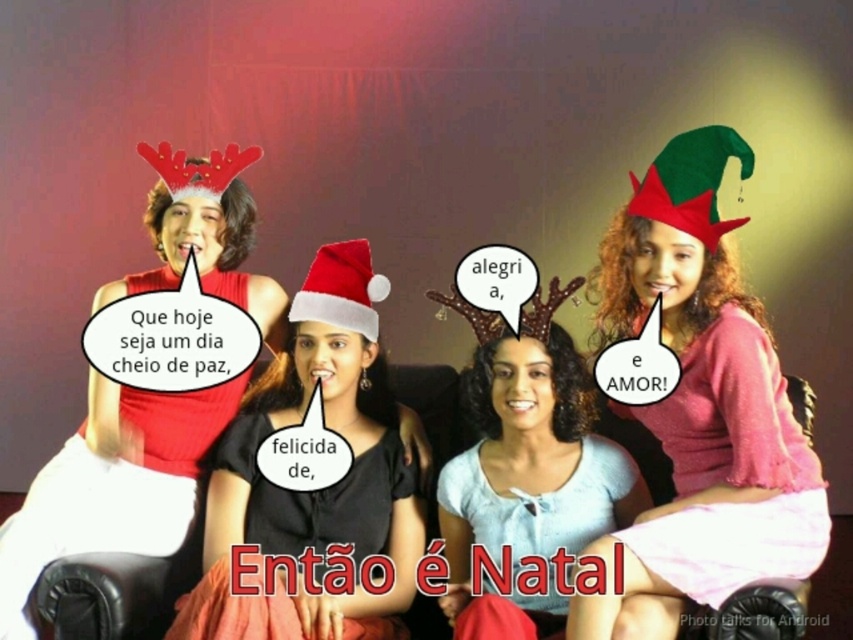
Question: Considering the real-world distances, which object is farthest from the matte red dress at left?

Choices:
 (A) green felt christmas hat at upper right
 (B) red velvet santa hat at center
 (C) matte red dress at center
 (D) pink matte sweater at upper right

Answer: (A)

Question: Does matte red dress at center have a larger size compared to green felt christmas hat at upper right?

Choices:
 (A) yes
 (B) no

Answer: (A)

Question: Among these points, which one is farthest from the camera?

Choices:
 (A) (198, 493)
 (B) (729, 438)

Answer: (A)

Question: Does matte red dress at center appear over white matte shirt at center?

Choices:
 (A) no
 (B) yes

Answer: (B)

Question: Does pink matte sweater at upper right lie in front of white matte shirt at center?

Choices:
 (A) yes
 (B) no

Answer: (A)

Question: Considering the real-world distances, which object is farthest from the matte red dress at center?

Choices:
 (A) red velvet santa hat at center
 (B) matte red dress at left
 (C) white matte shirt at center

Answer: (C)